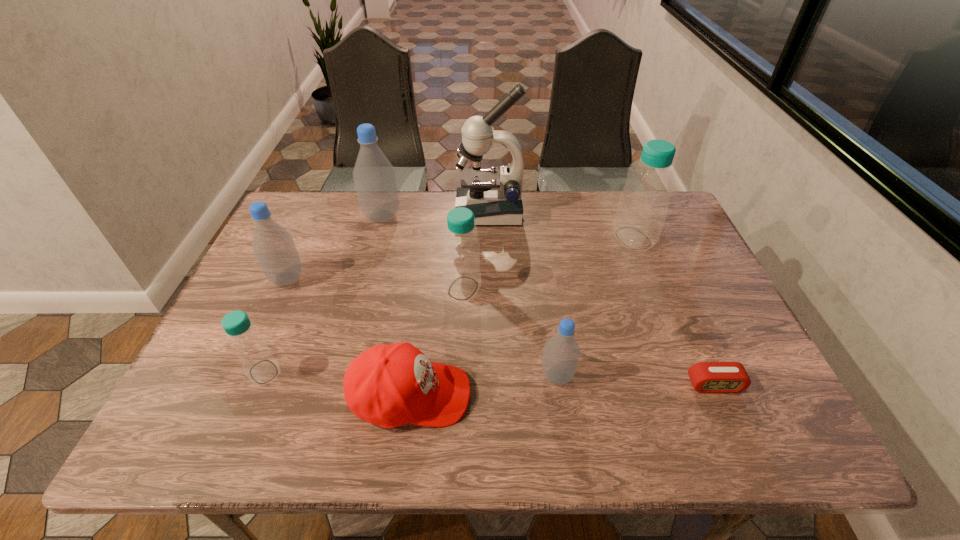
The height and width of the screenshot is (540, 960). In order to click on vacant space located on the left of the biggest blue bottle in this screenshot , I will do `click(539, 238)`.

The height and width of the screenshot is (540, 960). I want to click on vacant area situated on the front of the leftmost gray bottle, so click(218, 432).

Locate an element on the screen. Image resolution: width=960 pixels, height=540 pixels. blank area located 0.320m on the right of the second nearest blue bottle is located at coordinates (603, 288).

Find the location of a particular element. vacant space located on the right of the smallest gray bottle is located at coordinates (610, 376).

At what (x,y) coordinates should I click in order to perform the action: click on vacant region located on the right of the leftmost blue bottle. Please return your answer as a coordinate pair (x, y). The height and width of the screenshot is (540, 960). Looking at the image, I should click on (305, 372).

You are a GUI agent. You are given a task and a screenshot of the screen. Output one action in this format:
    pyautogui.click(x=<x>, y=<y>)
    Task: Click on the vacant space positioned on the front panel of the baseball cap
    
    Given the screenshot: What is the action you would take?
    pyautogui.click(x=560, y=395)

What are the coordinates of `vacant space situated 0.100m on the front-facing side of the pink alarm clock` in the screenshot? It's located at (738, 439).

Find the location of a particular element. microscope that is at the far edge is located at coordinates (495, 198).

Locate an element on the screen. The width and height of the screenshot is (960, 540). object positioned at the near edge is located at coordinates (389, 385).

At what (x,y) coordinates should I click in order to perform the action: click on bottle present at the right edge. Please return your answer as a coordinate pair (x, y). The height and width of the screenshot is (540, 960). Looking at the image, I should click on (643, 204).